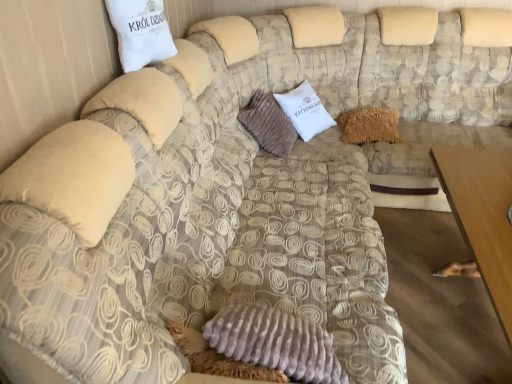
Question: From the image's perspective, is fuzzy brown pillow at center, placed as the 1th pillow when sorted from right to left, located above or below brown wooden table at lower right?

Choices:
 (A) below
 (B) above

Answer: (B)

Question: Is fuzzy brown pillow at center, the third pillow in the left-to-right sequence, wider or thinner than brown wooden table at lower right?

Choices:
 (A) wide
 (B) thin

Answer: (B)

Question: Which object is the farthest from the fuzzy brown pillow at center, the 3th pillow when ordered from front to back?

Choices:
 (A) brown wooden table at lower right
 (B) white cotton pillow at upper left, which appears as the third pillow when viewed from the back
 (C) fuzzy brown pillow at center, the second pillow when ordered from front to back

Answer: (B)

Question: Estimate the real-world distances between objects in this image. Which object is closer to the fuzzy brown pillow at center, the second pillow when ordered from front to back?

Choices:
 (A) fuzzy brown pillow at center, placed as the 1th pillow when sorted from right to left
 (B) brown wooden table at lower right
 (C) white cotton pillow at upper left, which appears as the third pillow when viewed from the back

Answer: (A)